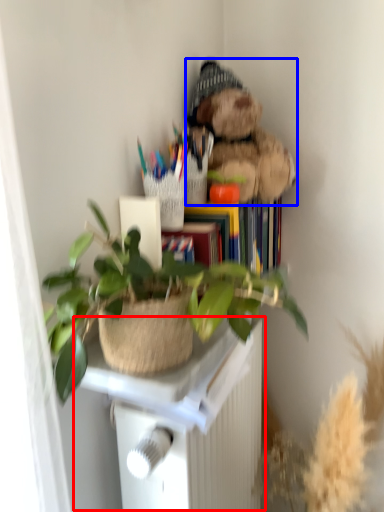
Question: Which object appears closest to the camera in this image, table (highlighted by a red box) or teddy bear (highlighted by a blue box)?

Choices:
 (A) table
 (B) teddy bear

Answer: (A)